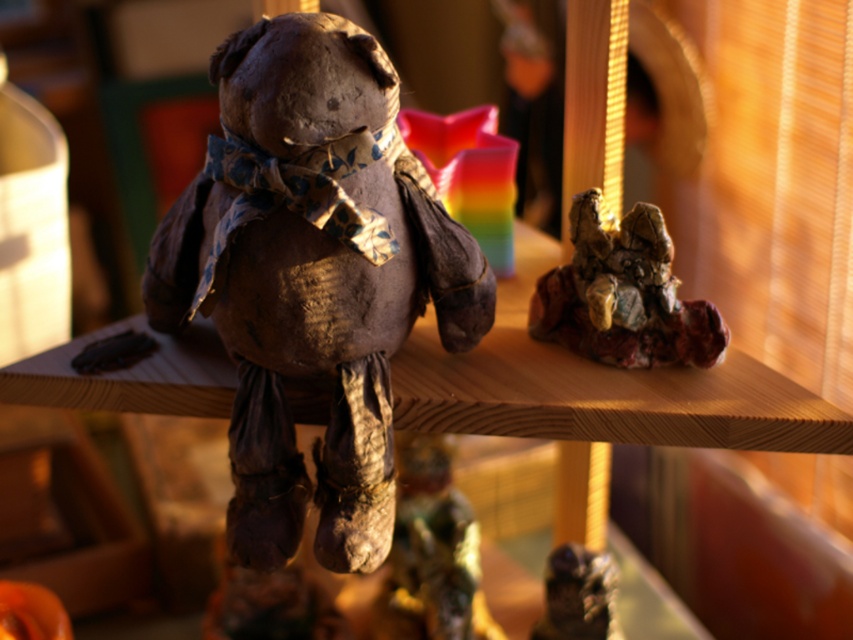
You are an interior designer arranging items on a shelf. You have a rusty metal figurine at lower center and a matte orange pumpkin at lower left. Which object should you place closer to the edge of the shelf to ensure stability?

The rusty metal figurine at lower center should be placed closer to the edge of the shelf because it might be wider than the matte orange pumpkin at lower left, providing a more stable base.

You are a delivery person who needs to place a new item that is 6 inches long between the shiny metallic dinosaur at center and the rusty metal figurine at lower center. Can you fit it there?

The shiny metallic dinosaur at center is 7.01 inches from the rusty metal figurine at lower center, so yes, the new item that is 6 inches long can fit between them since the distance is sufficient.